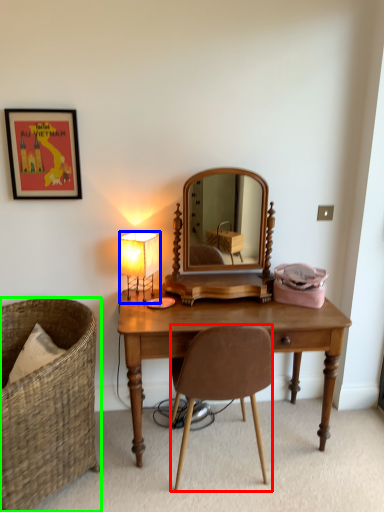
Question: Which object is the farthest from chair (highlighted by a red box)? Choose among these: lamp (highlighted by a blue box) or chair (highlighted by a green box).

Choices:
 (A) lamp
 (B) chair

Answer: (A)